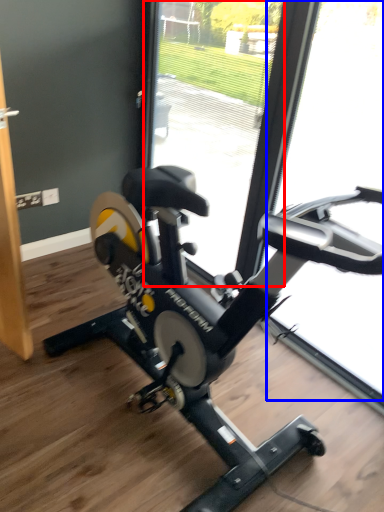
Question: Which object appears closest to the camera in this image, glass door (highlighted by a red box) or glass door (highlighted by a blue box)?

Choices:
 (A) glass door
 (B) glass door

Answer: (B)